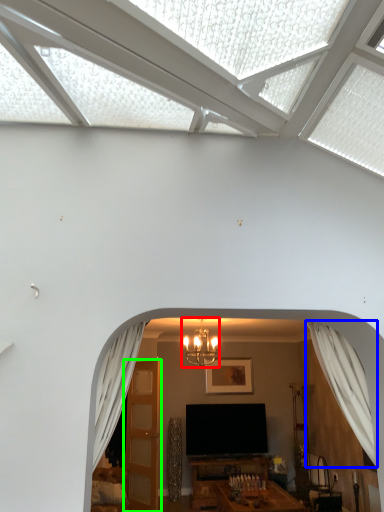
Question: Which object is positioned closest to light fixture (highlighted by a red box)? Select from curtain (highlighted by a blue box) and door (highlighted by a green box).

Choices:
 (A) curtain
 (B) door

Answer: (B)